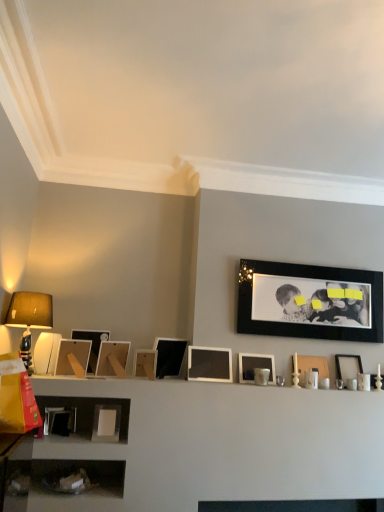
Question: Is matte wooden picture frame at left, which is counted as the second picture frame, starting from the left, taller than white matte picture frame at center, the 5th picture frame viewed from the right?

Choices:
 (A) no
 (B) yes

Answer: (B)

Question: Is matte wooden picture frame at left, which is counted as the second picture frame, starting from the left, at the right side of white matte picture frame at center, the 5th picture frame viewed from the right?

Choices:
 (A) no
 (B) yes

Answer: (A)

Question: Is matte wooden picture frame at left, the tenth picture frame from the right, positioned far away from white matte picture frame at center, the 5th picture frame viewed from the right?

Choices:
 (A) no
 (B) yes

Answer: (A)

Question: From the image's perspective, is matte wooden picture frame at left, which is counted as the second picture frame, starting from the left, beneath white matte picture frame at center, the seventh picture frame from the left?

Choices:
 (A) yes
 (B) no

Answer: (B)

Question: From the image's perspective, would you say matte wooden picture frame at left, the tenth picture frame from the right, is positioned over white matte picture frame at center, the 5th picture frame viewed from the right?

Choices:
 (A) yes
 (B) no

Answer: (A)

Question: From a real-world perspective, is matte wooden picture frame at lower left, the first picture frame from the left, above or below matte white picture frame at upper right, marked as the ninth picture frame in a left-to-right arrangement?

Choices:
 (A) below
 (B) above

Answer: (B)

Question: In terms of width, does matte wooden picture frame at lower left, acting as the 11th picture frame starting from the right, look wider or thinner when compared to matte white picture frame at upper right, marked as the ninth picture frame in a left-to-right arrangement?

Choices:
 (A) thin
 (B) wide

Answer: (B)

Question: From the image's perspective, is matte wooden picture frame at lower left, the first picture frame from the left, located above or below matte white picture frame at upper right, positioned as the third picture frame in right-to-left order?

Choices:
 (A) above
 (B) below

Answer: (A)

Question: In terms of height, does matte wooden picture frame at lower left, the first picture frame from the left, look taller or shorter compared to matte white picture frame at upper right, marked as the ninth picture frame in a left-to-right arrangement?

Choices:
 (A) short
 (B) tall

Answer: (B)

Question: Would you say matte wooden picture frame at center, the 4th picture frame from the left, is inside or outside white matte picture frame at center, the 5th picture frame viewed from the right?

Choices:
 (A) outside
 (B) inside

Answer: (A)

Question: In the image, is matte wooden picture frame at center, positioned as the 8th picture frame in right-to-left order, positioned in front of or behind white matte picture frame at center, the seventh picture frame from the left?

Choices:
 (A) behind
 (B) front

Answer: (B)

Question: In terms of size, does matte wooden picture frame at center, positioned as the 8th picture frame in right-to-left order, appear bigger or smaller than white matte picture frame at center, the seventh picture frame from the left?

Choices:
 (A) big
 (B) small

Answer: (A)

Question: In the image, is matte wooden picture frame at center, positioned as the 8th picture frame in right-to-left order, on the left side or the right side of white matte picture frame at center, the seventh picture frame from the left?

Choices:
 (A) left
 (B) right

Answer: (A)

Question: From the image's perspective, is matte black picture frame at center, which is counted as the sixth picture frame, starting from the left, located above or below white matte picture frame at center, the seventh picture frame from the left?

Choices:
 (A) above
 (B) below

Answer: (A)

Question: Is point click(x=168, y=352) positioned closer to the camera than point click(x=223, y=361)?

Choices:
 (A) closer
 (B) farther

Answer: (A)